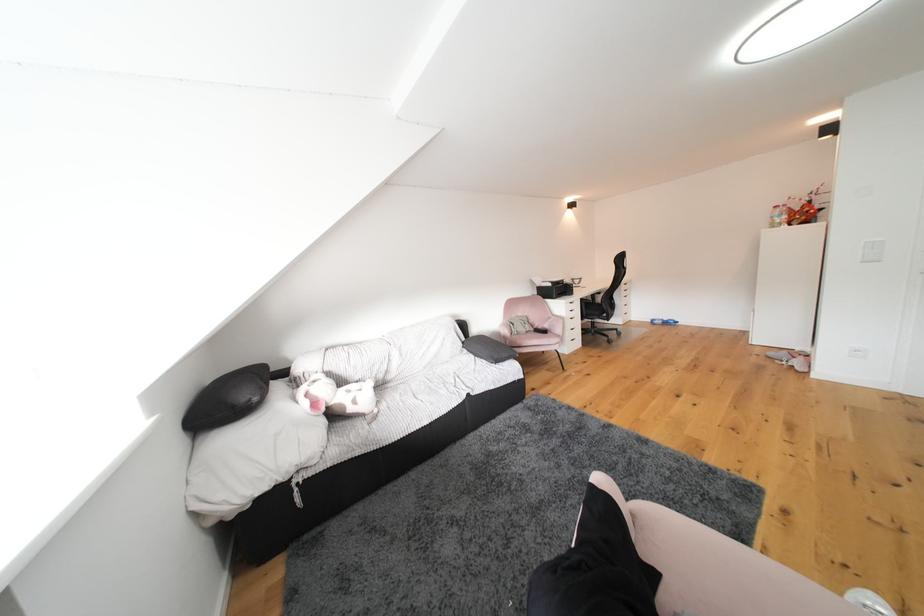
Describe the element at coordinates (517, 337) in the screenshot. I see `the pink chair armrest` at that location.